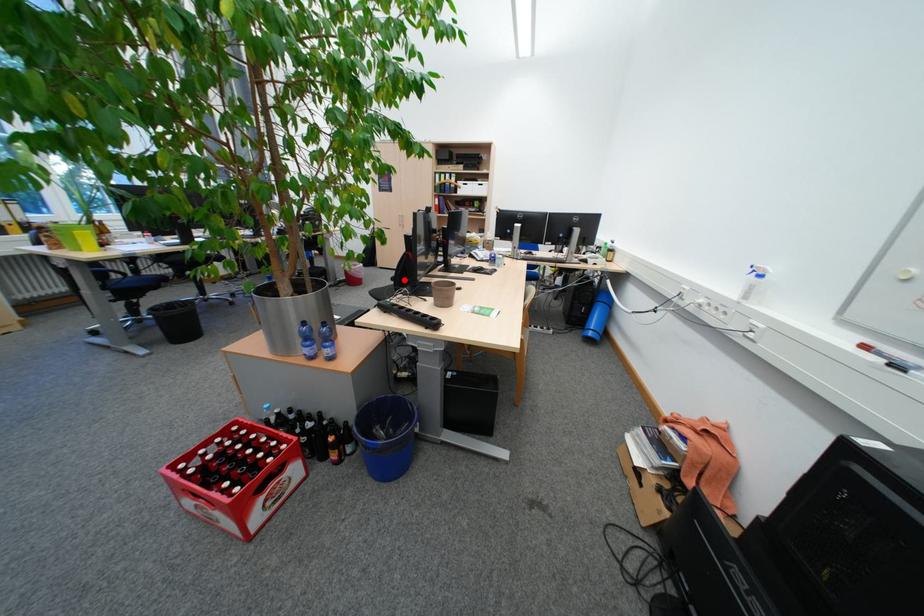
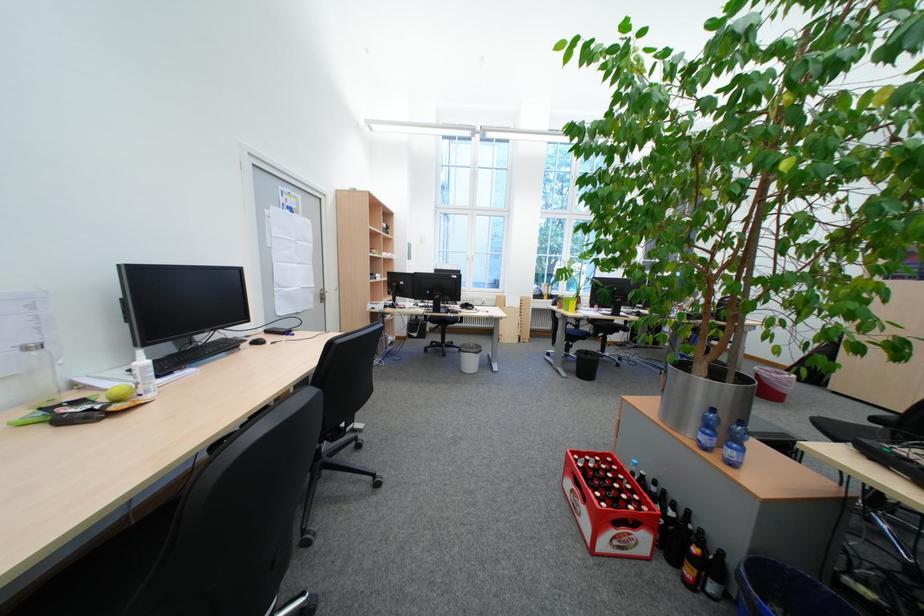
Locate, in the second image, the point that corresponds to the highlighted location in the first image.

(886, 421)